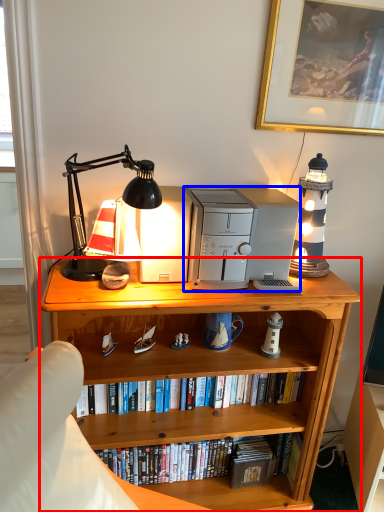
Question: Among these objects, which one is nearest to the camera, bookcase (highlighted by a red box) or appliance (highlighted by a blue box)?

Choices:
 (A) bookcase
 (B) appliance

Answer: (A)